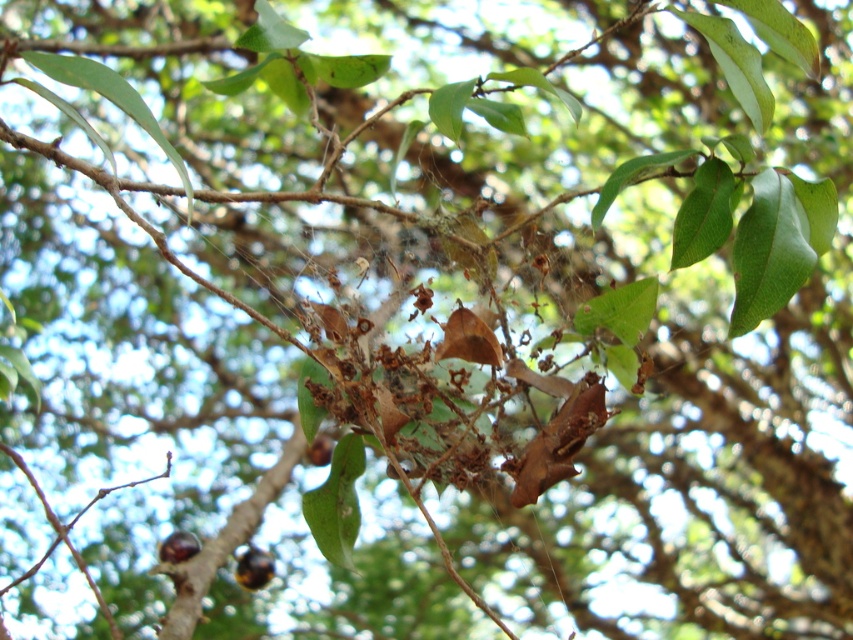
Question: Which is nearer to the brown matte fruit at center?

Choices:
 (A) shiny brown nut at lower center
 (B) shiny brown nut at lower left

Answer: (A)

Question: In this image, where is shiny brown nut at lower left located relative to brown matte fruit at center?

Choices:
 (A) below
 (B) above

Answer: (A)

Question: Which object appears closest to the camera in this image?

Choices:
 (A) brown matte fruit at center
 (B) shiny brown nut at lower left
 (C) shiny brown nut at lower center

Answer: (B)

Question: Can you confirm if shiny brown nut at lower center is bigger than brown matte fruit at center?

Choices:
 (A) yes
 (B) no

Answer: (B)

Question: Which point appears farthest from the camera in this image?

Choices:
 (A) (258, 552)
 (B) (173, 560)
 (C) (306, 449)

Answer: (C)

Question: Is shiny brown nut at lower center below shiny brown nut at lower left?

Choices:
 (A) no
 (B) yes

Answer: (B)